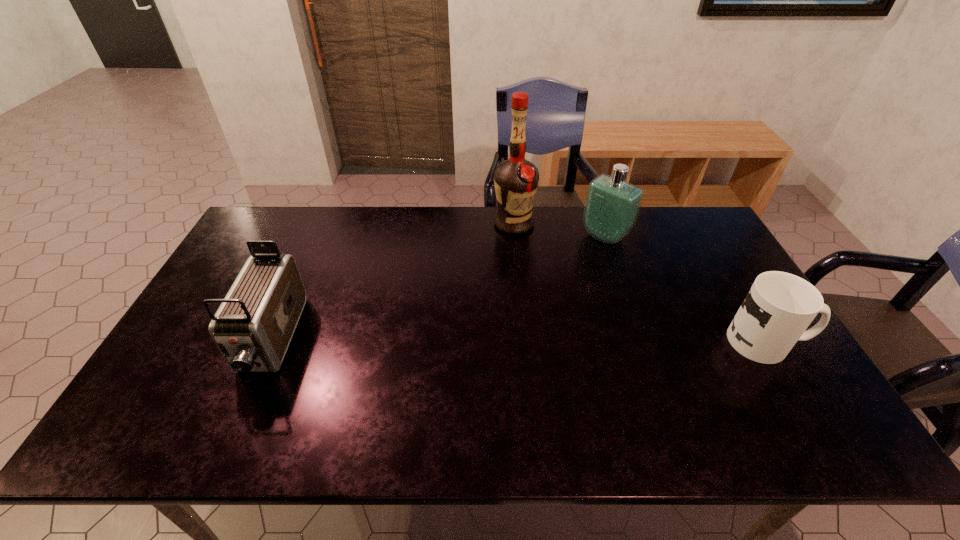
Find the location of a particular element. The image size is (960, 540). free space between the shortest object and the second object from left to right is located at coordinates (639, 282).

You are a GUI agent. You are given a task and a screenshot of the screen. Output one action in this format:
    pyautogui.click(x=<x>, y=<y>)
    Task: Click on the closest object relative to the leftmost object
    
    Given the screenshot: What is the action you would take?
    pyautogui.click(x=516, y=180)

Choose which object is the second nearest neighbor to the rightmost object. Please provide its 2D coordinates. Your answer should be formatted as a tuple, i.e. [(x, y)], where the tuple contains the x and y coordinates of a point satisfying the conditions above.

[(516, 180)]

Find the location of a particular element. Image resolution: width=960 pixels, height=540 pixels. free space that satisfies the following two spatial constraints: 1. at the lens of the camcorder; 2. on the handle side of the mug is located at coordinates (271, 341).

The height and width of the screenshot is (540, 960). Identify the location of free space that satisfies the following two spatial constraints: 1. at the lens of the camcorder; 2. on the handle side of the rightmost object. (271, 341).

The height and width of the screenshot is (540, 960). What are the coordinates of `free spot that satisfies the following two spatial constraints: 1. on the front side of the perfume; 2. on the right side of the second object from left to right` in the screenshot? It's located at (515, 236).